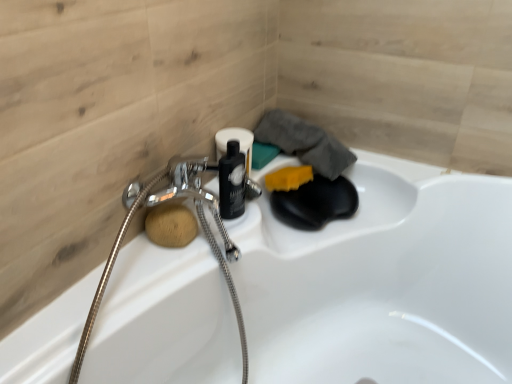
Question: From a real-world perspective, is wooden sponge at lower left, the first soap viewed from the front, below metallic silver garden hose at left?

Choices:
 (A) no
 (B) yes

Answer: (A)

Question: Is wooden sponge at lower left, which is the 1th soap in bottom-to-top order, in front of metallic silver garden hose at left?

Choices:
 (A) no
 (B) yes

Answer: (A)

Question: Are wooden sponge at lower left, which ranks as the second soap in top-to-bottom order, and metallic silver garden hose at left making contact?

Choices:
 (A) yes
 (B) no

Answer: (B)

Question: Is wooden sponge at lower left, marked as the first soap in a left-to-right arrangement, positioned beyond the bounds of metallic silver garden hose at left?

Choices:
 (A) no
 (B) yes

Answer: (A)

Question: Is wooden sponge at lower left, the first soap viewed from the front, wider than metallic silver garden hose at left?

Choices:
 (A) no
 (B) yes

Answer: (A)

Question: From the image's perspective, is yellow sponge at upper right, the first soap in the right-to-left sequence, located above or below metallic silver garden hose at left?

Choices:
 (A) below
 (B) above

Answer: (B)

Question: Relative to metallic silver garden hose at left, is yellow sponge at upper right, positioned as the second soap in front-to-back order, in front or behind?

Choices:
 (A) behind
 (B) front

Answer: (A)

Question: Considering the positions of yellow sponge at upper right, the first soap in the right-to-left sequence, and metallic silver garden hose at left in the image, is yellow sponge at upper right, the first soap in the right-to-left sequence, wider or thinner than metallic silver garden hose at left?

Choices:
 (A) thin
 (B) wide

Answer: (A)

Question: Considering the positions of yellow sponge at upper right, the second soap in the bottom-to-top sequence, and metallic silver garden hose at left in the image, is yellow sponge at upper right, the second soap in the bottom-to-top sequence, taller or shorter than metallic silver garden hose at left?

Choices:
 (A) short
 (B) tall

Answer: (A)

Question: From the image's perspective, relative to wooden sponge at lower left, the first soap viewed from the front, is yellow sponge at upper right, positioned as the second soap in left-to-right order, above or below?

Choices:
 (A) above
 (B) below

Answer: (A)

Question: Is yellow sponge at upper right, positioned as the second soap in front-to-back order, situated inside wooden sponge at lower left, which ranks as the second soap in top-to-bottom order, or outside?

Choices:
 (A) outside
 (B) inside

Answer: (A)

Question: From a real-world perspective, is yellow sponge at upper right, positioned as the second soap in front-to-back order, positioned above or below wooden sponge at lower left, which ranks as the 2th soap in back-to-front order?

Choices:
 (A) above
 (B) below

Answer: (B)

Question: Considering the positions of yellow sponge at upper right, positioned as the second soap in left-to-right order, and wooden sponge at lower left, which ranks as the second soap in top-to-bottom order, in the image, is yellow sponge at upper right, positioned as the second soap in left-to-right order, bigger or smaller than wooden sponge at lower left, which ranks as the second soap in top-to-bottom order,?

Choices:
 (A) big
 (B) small

Answer: (A)

Question: From the image's perspective, is wooden sponge at lower left, marked as the first soap in a left-to-right arrangement, positioned above or below metallic silver garden hose at left?

Choices:
 (A) below
 (B) above

Answer: (B)

Question: Is wooden sponge at lower left, which ranks as the second soap in right-to-left order, in front of or behind metallic silver garden hose at left in the image?

Choices:
 (A) behind
 (B) front

Answer: (A)